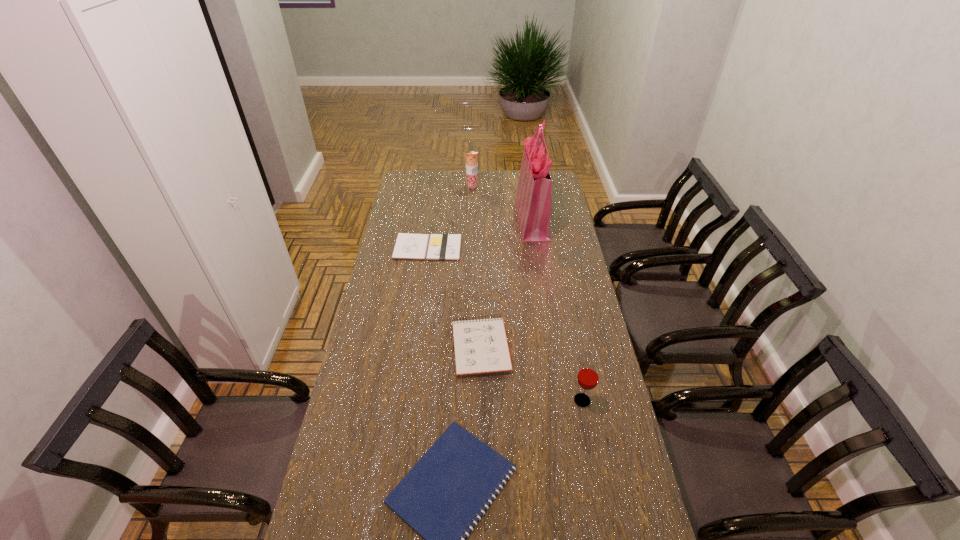
Where is `the tallest object`? the tallest object is located at coordinates (532, 203).

In order to click on the fifth shortest object in this screenshot , I will do `click(471, 158)`.

Where is `the farthest object`? The image size is (960, 540). the farthest object is located at coordinates (471, 158).

Identify the location of the second nearest object. (588, 376).

Locate an element on the screen. The width and height of the screenshot is (960, 540). the fourth shortest object is located at coordinates (588, 376).

Find the location of a particular element. the tallest notepad is located at coordinates (480, 346).

Where is `the second farthest notepad`? the second farthest notepad is located at coordinates (480, 346).

At what (x,y) coordinates should I click in order to perform the action: click on the second shortest object. Please return your answer as a coordinate pair (x, y). Image resolution: width=960 pixels, height=540 pixels. Looking at the image, I should click on (407, 246).

I want to click on the second tallest notepad, so click(x=407, y=246).

Locate an element on the screen. free location located 0.080m on the left of the tallest object is located at coordinates (500, 220).